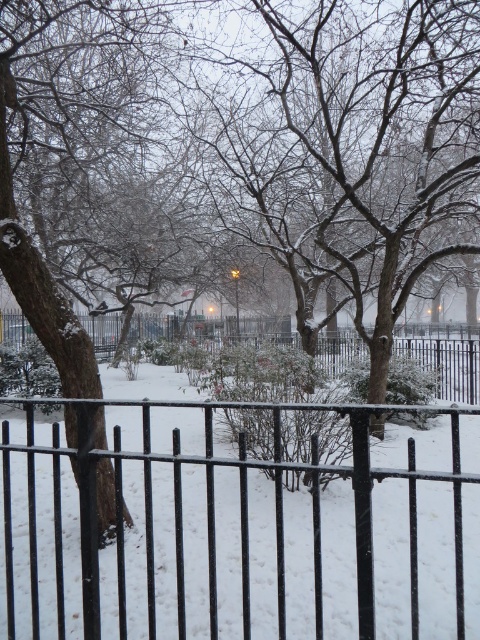
Between point (466, 234) and point (355, 538), which one is positioned behind?

The point (466, 234) is more distant.

Is snow-covered branches at center closer to the viewer compared to black metal fence at center?

No.

This screenshot has height=640, width=480. Describe the element at coordinates (356, 141) in the screenshot. I see `snow-covered branches at center` at that location.

This screenshot has width=480, height=640. Identify the location of snow-covered branches at center. (356, 141).